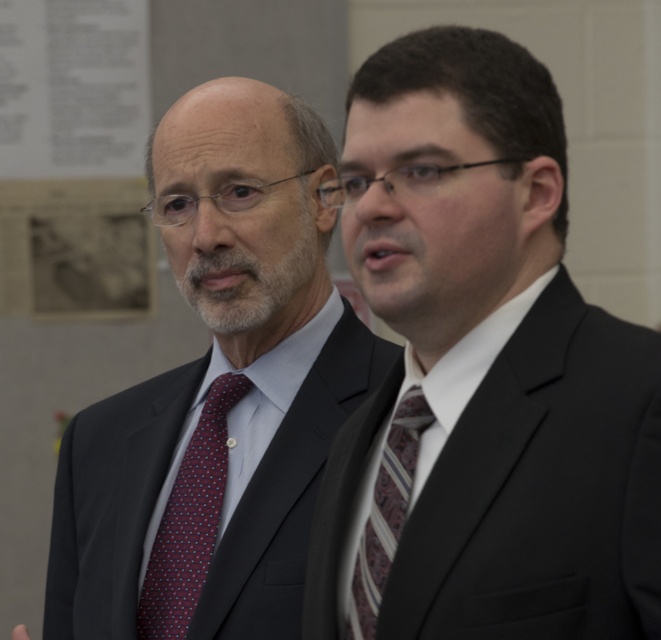
Is dark red textured tie at left closer to camera compared to striped silk tie at right?

No, dark red textured tie at left is behind striped silk tie at right.

Image resolution: width=661 pixels, height=640 pixels. What are the coordinates of `dark red textured tie at left` in the screenshot? It's located at (188, 518).

Locate an element on the screen. dark red textured tie at left is located at coordinates (188, 518).

Between matte black suit at left and striped silk tie at right, which one has more height?

matte black suit at left

Is matte black suit at left wider than striped silk tie at right?

Yes.

Where is `matte black suit at left`? The width and height of the screenshot is (661, 640). matte black suit at left is located at coordinates (217, 385).

The height and width of the screenshot is (640, 661). What do you see at coordinates (496, 362) in the screenshot?
I see `dark suit at right` at bounding box center [496, 362].

Does dark suit at right have a lesser height compared to striped silk tie at right?

Incorrect, dark suit at right's height does not fall short of striped silk tie at right's.

Between point (307, 634) and point (399, 464), which one is positioned behind?

The point (307, 634) is behind.

Find the location of a particular element. dark suit at right is located at coordinates (496, 362).